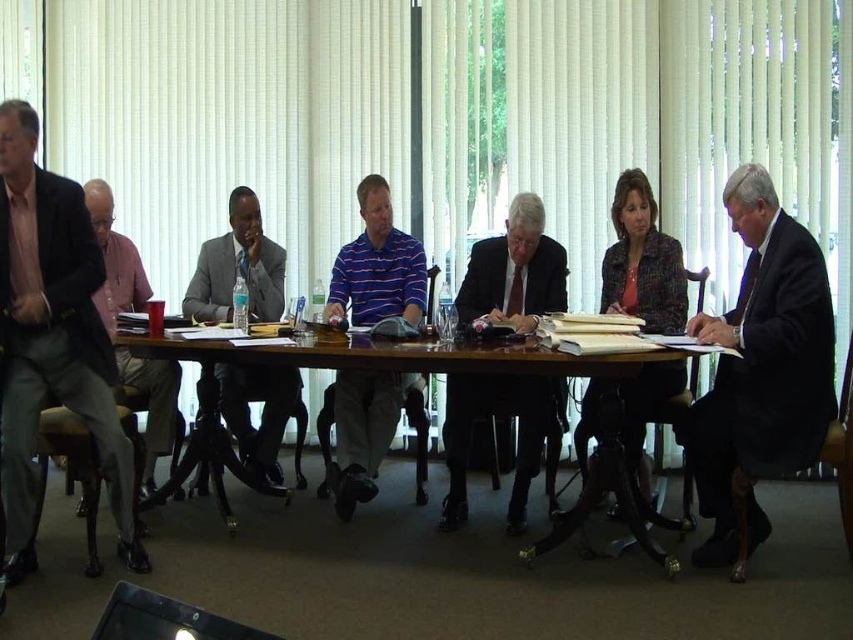
You are organizing a photo shoot and need to place a large camera on the table between the light brown suit at left and the pink shirt at left. Based on their spatial arrangement, will there be enough space for the camera?

The light brown suit at left occupies less space than the pink shirt at left, so there might be enough space between them for the camera, but it depends on the camera size. The pink shirt at left takes up more space, so the gap could accommodate a moderately sized camera.

In the conference room scene, there are two individuals wearing a dark suit at center and a gray suit at center. Which one is positioned to the right of the other?

The dark suit at center is to the right of the gray suit at center.

You are a photographer trying to capture a candid shot of the meeting participants. You notice the light brown suit at left and the patterned fabric blazer at center. Which clothing item will appear larger in your photo due to its actual size?

The light brown suit at left will appear larger in the photo because it has a greater height compared to the patterned fabric blazer at center.